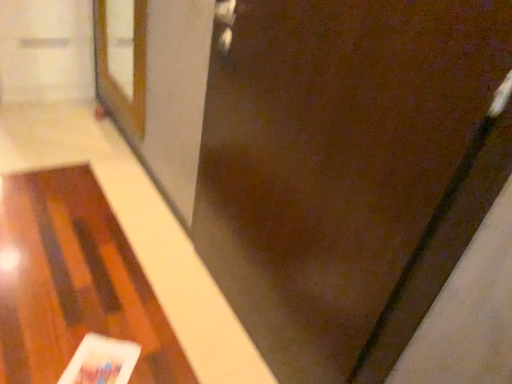
Question: Is brown matte door at center at the back of wooden table at lower left?

Choices:
 (A) yes
 (B) no

Answer: (B)

Question: From a real-world perspective, is wooden table at lower left on brown matte door at center?

Choices:
 (A) no
 (B) yes

Answer: (A)

Question: Is the surface of wooden table at lower left in direct contact with brown matte door at center?

Choices:
 (A) no
 (B) yes

Answer: (A)

Question: From a real-world perspective, is wooden table at lower left physically below brown matte door at center?

Choices:
 (A) yes
 (B) no

Answer: (A)

Question: Can you confirm if wooden table at lower left is wider than brown matte door at center?

Choices:
 (A) no
 (B) yes

Answer: (B)

Question: Would you say brown matte door at center is inside or outside white glossy magazine at lower left?

Choices:
 (A) inside
 (B) outside

Answer: (B)

Question: Is brown matte door at center wider or thinner than white glossy magazine at lower left?

Choices:
 (A) thin
 (B) wide

Answer: (A)

Question: Is brown matte door at center bigger or smaller than white glossy magazine at lower left?

Choices:
 (A) big
 (B) small

Answer: (A)

Question: Is brown matte door at center in front of or behind white glossy magazine at lower left in the image?

Choices:
 (A) front
 (B) behind

Answer: (A)

Question: Is brown wooden screen door at upper left inside the boundaries of white glossy magazine at lower left, or outside?

Choices:
 (A) outside
 (B) inside

Answer: (A)

Question: Visually, is brown wooden screen door at upper left positioned to the left or to the right of white glossy magazine at lower left?

Choices:
 (A) left
 (B) right

Answer: (A)

Question: From the image's perspective, is brown wooden screen door at upper left positioned above or below white glossy magazine at lower left?

Choices:
 (A) above
 (B) below

Answer: (A)

Question: In the image, is brown wooden screen door at upper left positioned in front of or behind white glossy magazine at lower left?

Choices:
 (A) front
 (B) behind

Answer: (B)

Question: From a real-world perspective, is brown matte door at center physically located above or below wooden table at lower left?

Choices:
 (A) above
 (B) below

Answer: (A)

Question: In terms of size, does brown matte door at center appear bigger or smaller than wooden table at lower left?

Choices:
 (A) small
 (B) big

Answer: (B)